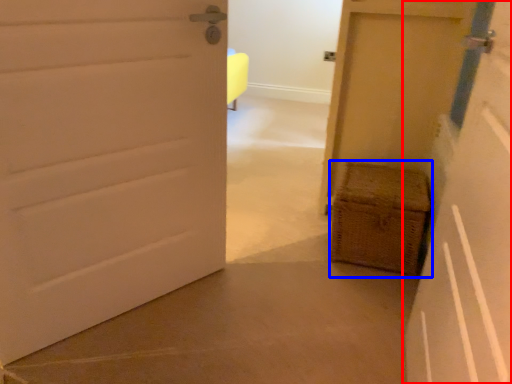
Question: Which object is closer to the camera taking this photo, door (highlighted by a red box) or basket (highlighted by a blue box)?

Choices:
 (A) door
 (B) basket

Answer: (A)